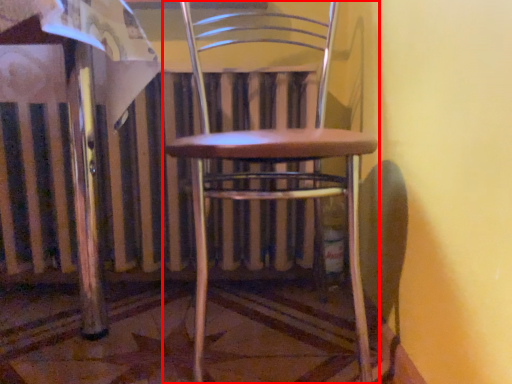
Question: From the image's perspective, what is the correct spatial relationship of chair (annotated by the red box) in relation to radiator?

Choices:
 (A) below
 (B) above

Answer: (B)